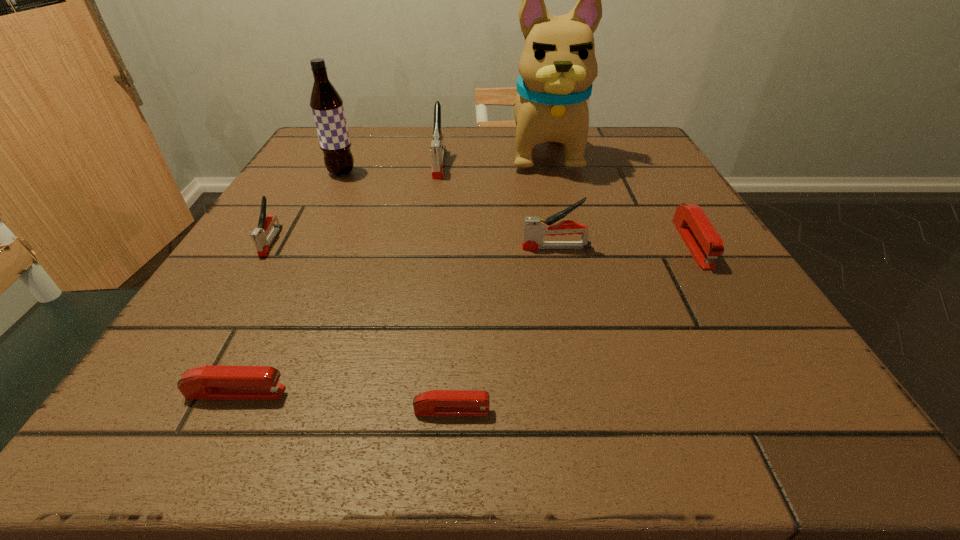
Find the location of a particular element. the sixth tallest object is located at coordinates (704, 243).

Find the location of a particular element. the biggest red stapler is located at coordinates (704, 243).

The height and width of the screenshot is (540, 960). In order to click on the fifth tallest stapler in this screenshot , I will do `click(209, 381)`.

The image size is (960, 540). I want to click on the second nearest object, so click(209, 381).

Identify the location of the nearest object. The width and height of the screenshot is (960, 540). (436, 402).

Locate an element on the screen. the shortest object is located at coordinates (436, 402).

I want to click on vacant space located on the face of the tallest object, so click(x=565, y=234).

Image resolution: width=960 pixels, height=540 pixels. Identify the location of vacant region located on the back of the root beer. click(x=363, y=130).

Locate an element on the screen. The image size is (960, 540). vacant space located on the handle side of the farthest gray stapler is located at coordinates (419, 305).

At what (x,y) coordinates should I click in order to perform the action: click on vacant region located 0.200m on the handle side of the rightmost gray stapler. Please return your answer as a coordinate pair (x, y). Looking at the image, I should click on (409, 247).